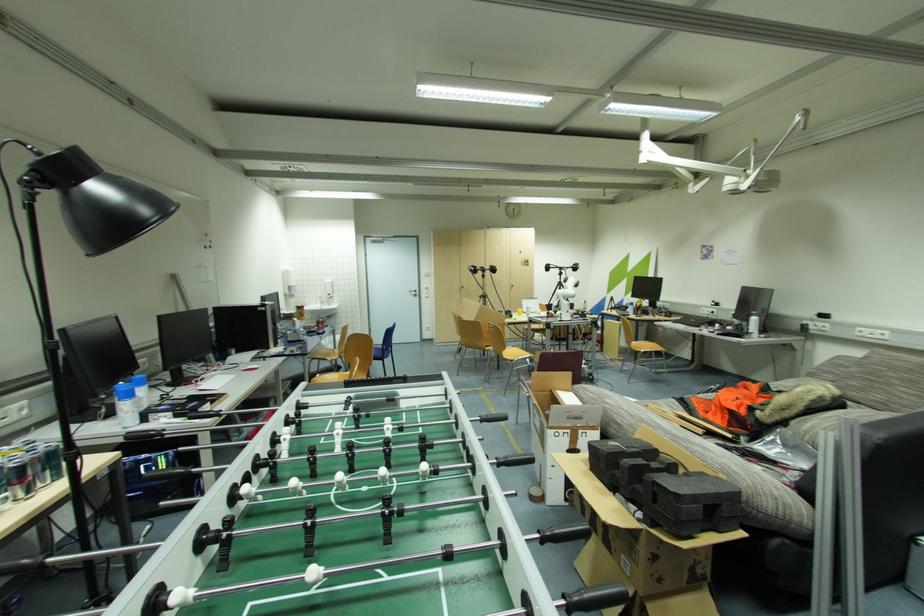
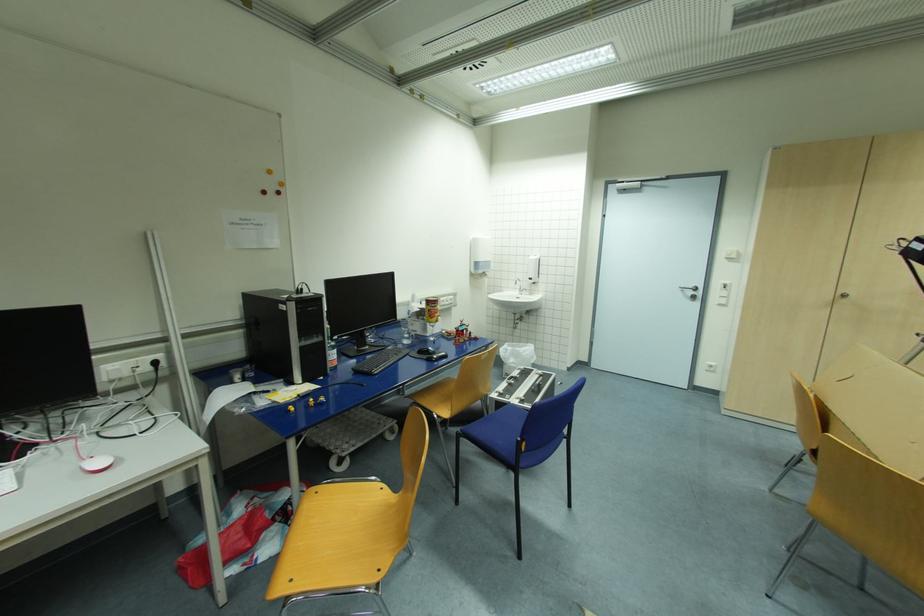
Where in the second image is the point corresponding to the point at 325,304 from the first image?

(525, 291)